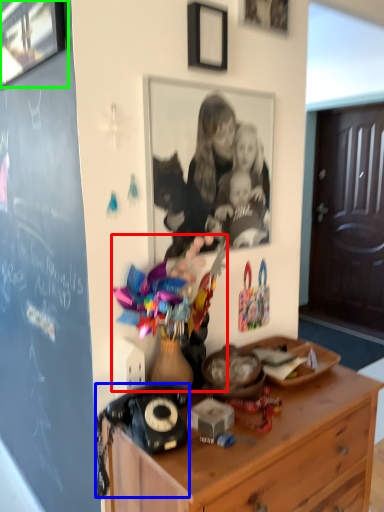
Question: Which object is positioned closest to toy (highlighted by a red box)? Select from corded phone (highlighted by a blue box) and picture frame (highlighted by a green box).

Choices:
 (A) corded phone
 (B) picture frame

Answer: (A)